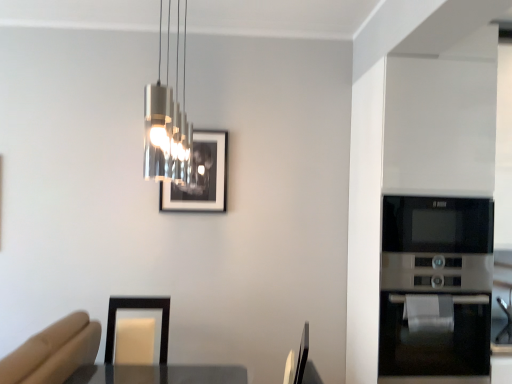
Describe the element at coordinates (201, 177) in the screenshot. I see `matte black picture frame at upper center` at that location.

The image size is (512, 384). What do you see at coordinates (166, 127) in the screenshot? I see `metallic cylindrical light fixture at upper center` at bounding box center [166, 127].

Where is `black glass microwave at right`? black glass microwave at right is located at coordinates (435, 288).

Is black glass microwave at right in contact with metallic cylindrical light fixture at upper center?

black glass microwave at right is not next to metallic cylindrical light fixture at upper center, and they're not touching.

This screenshot has height=384, width=512. In order to click on appliance behind the metallic cylindrical light fixture at upper center in this screenshot , I will do `click(435, 288)`.

In terms of height, does black glass microwave at right look taller or shorter compared to metallic cylindrical light fixture at upper center?

Clearly, black glass microwave at right is taller compared to metallic cylindrical light fixture at upper center.

How many degrees apart are the facing directions of black glass microwave at right and metallic cylindrical light fixture at upper center?

black glass microwave at right and metallic cylindrical light fixture at upper center are facing 90.6 degrees away from each other.

How different are the orientations of black glass microwave at right and matte black picture frame at upper center in degrees?

The angle between the facing direction of black glass microwave at right and the facing direction of matte black picture frame at upper center is 0.295 degrees.

Is black glass microwave at right far from matte black picture frame at upper center?

black glass microwave at right is positioned a significant distance from matte black picture frame at upper center.

Is black glass microwave at right positioned in front of matte black picture frame at upper center?

Yes, black glass microwave at right is closer to the viewer.

Considering the sizes of objects black glass microwave at right and matte black picture frame at upper center in the image provided, who is thinner, black glass microwave at right or matte black picture frame at upper center?

Thinner between the two is matte black picture frame at upper center.

Consider the image. Is matte black picture frame at upper center to the left of black glass microwave at right from the viewer's perspective?

Indeed, matte black picture frame at upper center is positioned on the left side of black glass microwave at right.

Between point (213, 200) and point (393, 258), which one is positioned behind?

The point (213, 200) is farther from the camera.

Considering the relative sizes of matte black picture frame at upper center and black glass microwave at right in the image provided, is matte black picture frame at upper center smaller than black glass microwave at right?

Yes, matte black picture frame at upper center is smaller than black glass microwave at right.

From a real-world perspective, is matte black picture frame at upper center positioned above or below black glass microwave at right?

matte black picture frame at upper center is above black glass microwave at right.

Between point (157, 96) and point (419, 201), which one is positioned in front?

The point (157, 96) is more forward.

The width and height of the screenshot is (512, 384). What are the coordinates of `appliance below the metallic cylindrical light fixture at upper center (from the image's perspective)` in the screenshot? It's located at (435, 288).

Considering the positions of objects metallic cylindrical light fixture at upper center and black glass microwave at right in the image provided, who is more to the left, metallic cylindrical light fixture at upper center or black glass microwave at right?

metallic cylindrical light fixture at upper center is more to the left.

From a real-world perspective, is metallic cylindrical light fixture at upper center below black glass microwave at right?

No, from a real-world perspective, metallic cylindrical light fixture at upper center is not below black glass microwave at right.

How different are the orientations of matte black picture frame at upper center and metallic cylindrical light fixture at upper center in degrees?

The angular difference between matte black picture frame at upper center and metallic cylindrical light fixture at upper center is 90.3 degrees.

Does matte black picture frame at upper center have a lesser width compared to metallic cylindrical light fixture at upper center?

Yes.

Considering the relative positions of matte black picture frame at upper center and metallic cylindrical light fixture at upper center in the image provided, is matte black picture frame at upper center to the left or to the right of metallic cylindrical light fixture at upper center?

Based on their positions, matte black picture frame at upper center is located to the left of metallic cylindrical light fixture at upper center.

Which is more distant, [195,155] or [166,137]?

Positioned behind is point [195,155].

Consider the image. Looking at the image, does metallic cylindrical light fixture at upper center seem bigger or smaller compared to matte black picture frame at upper center?

Considering their sizes, metallic cylindrical light fixture at upper center takes up more space than matte black picture frame at upper center.

Between metallic cylindrical light fixture at upper center and matte black picture frame at upper center, which one has less height?

matte black picture frame at upper center.

Could matte black picture frame at upper center be considered to be inside metallic cylindrical light fixture at upper center?

No, metallic cylindrical light fixture at upper center does not contain matte black picture frame at upper center.

Based on the photo, measure the distance between metallic cylindrical light fixture at upper center and matte black picture frame at upper center.

metallic cylindrical light fixture at upper center and matte black picture frame at upper center are 6.72 inches apart from each other.

Find the location of `lamp located in front of the black glass microwave at right`. lamp located in front of the black glass microwave at right is located at coordinates (166, 127).

This screenshot has width=512, height=384. What are the coordinates of `appliance that appears below the matte black picture frame at upper center (from the image's perspective)` in the screenshot? It's located at (435, 288).

Estimate the real-world distances between objects in this image. Which object is closer to matte black picture frame at upper center, metallic cylindrical light fixture at upper center or black glass microwave at right?

metallic cylindrical light fixture at upper center.

When comparing their distances from black glass microwave at right, does matte black picture frame at upper center or metallic cylindrical light fixture at upper center seem closer?

matte black picture frame at upper center is closer to black glass microwave at right.

Which object lies further to the anchor point metallic cylindrical light fixture at upper center, black glass microwave at right or matte black picture frame at upper center?

black glass microwave at right is positioned further to the anchor metallic cylindrical light fixture at upper center.

When comparing their distances from metallic cylindrical light fixture at upper center, does matte black picture frame at upper center or black glass microwave at right seem closer?

matte black picture frame at upper center is closer to metallic cylindrical light fixture at upper center.

Looking at the image, which one is located further to matte black picture frame at upper center, black glass microwave at right or metallic cylindrical light fixture at upper center?

black glass microwave at right is further to matte black picture frame at upper center.

Based on their spatial positions, is metallic cylindrical light fixture at upper center or matte black picture frame at upper center further from black glass microwave at right?

Among the two, metallic cylindrical light fixture at upper center is located further to black glass microwave at right.

This screenshot has height=384, width=512. In order to click on lamp between matte black picture frame at upper center and black glass microwave at right in the horizontal direction in this screenshot , I will do `click(166, 127)`.